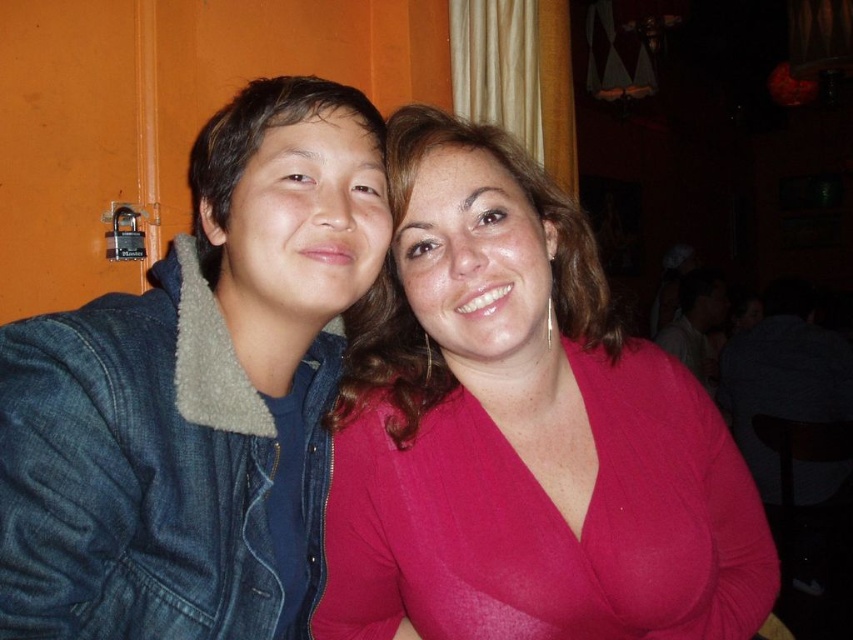
Is denim jacket at left wider than matte white shirt at upper right?

In fact, denim jacket at left might be narrower than matte white shirt at upper right.

What do you see at coordinates (196, 394) in the screenshot? I see `denim jacket at left` at bounding box center [196, 394].

At what (x,y) coordinates should I click in order to perform the action: click on denim jacket at left. Please return your answer as a coordinate pair (x, y). Looking at the image, I should click on (196, 394).

Who is taller, matte pink blouse at center or matte white shirt at upper right?

matte pink blouse at center is taller.

Consider the image. Does matte pink blouse at center appear under matte white shirt at upper right?

Yes, matte pink blouse at center is below matte white shirt at upper right.

Who is more distant from viewer, (682, 609) or (706, 384)?

Point (706, 384)

Locate an element on the screen. This screenshot has height=640, width=853. matte pink blouse at center is located at coordinates (521, 433).

Can you confirm if matte pink blouse at center is wider than denim jacket at left?

Yes.

Can you confirm if matte pink blouse at center is shorter than denim jacket at left?

Correct, matte pink blouse at center is not as tall as denim jacket at left.

The image size is (853, 640). Identify the location of matte pink blouse at center. (521, 433).

Identify the location of matte pink blouse at center. The image size is (853, 640). (521, 433).